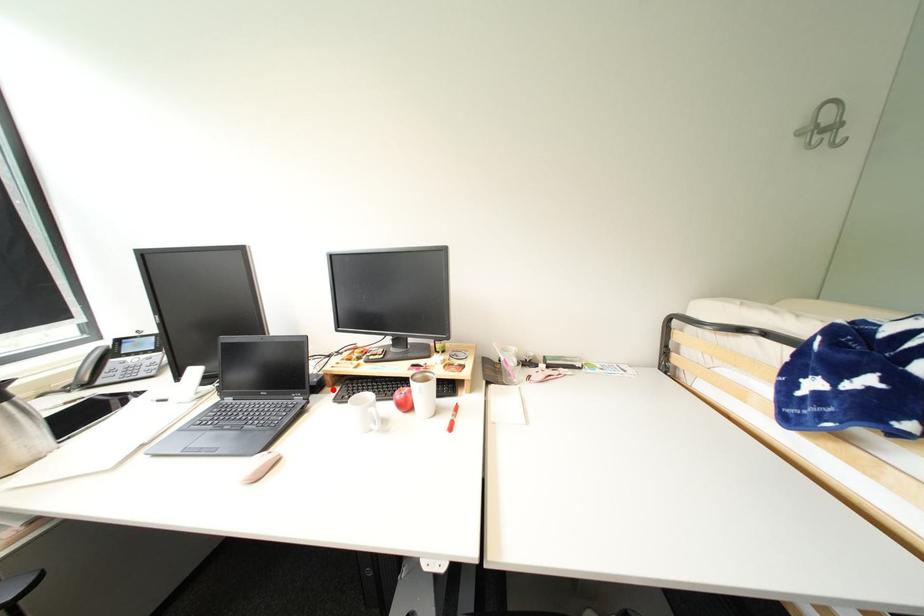
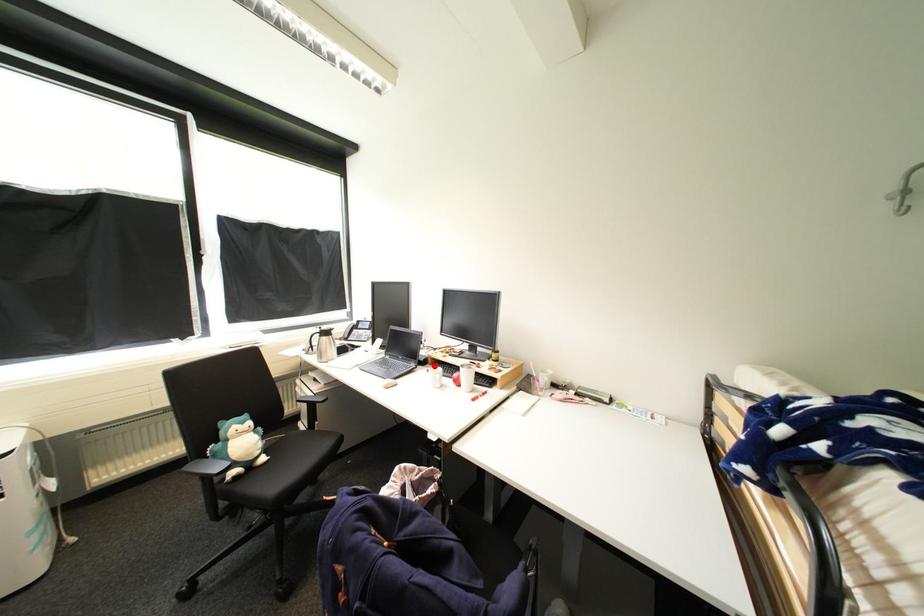
Based on the photo, I am providing you with two images of the same scene from different viewpoints. A red point is marked on the first image and another point is marked on the second image. Are the points marked in image1 and image2 representing the same 3D position?

Yes